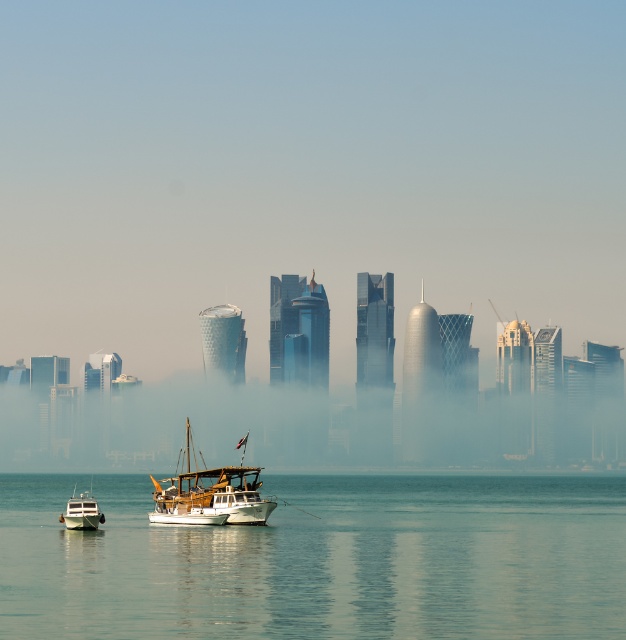
Question: Among these objects, which one is nearest to the camera?

Choices:
 (A) wooden sailboat at center
 (B) clear water at center
 (C) white wooden boat at lower left

Answer: (B)

Question: Observing the image, what is the correct spatial positioning of clear water at center in reference to white wooden boat at lower left?

Choices:
 (A) left
 (B) right

Answer: (B)

Question: Where is wooden sailboat at center located in relation to white wooden boat at lower left in the image?

Choices:
 (A) above
 (B) below

Answer: (A)

Question: Estimate the real-world distances between objects in this image. Which object is farther from the clear water at center?

Choices:
 (A) wooden sailboat at center
 (B) foggy glassy skyline at center

Answer: (B)

Question: Among these points, which one is nearest to the camera?

Choices:
 (A) (78, 497)
 (B) (590, 372)
 (C) (203, 518)
 (D) (382, 504)

Answer: (C)

Question: Considering the relative positions of wooden sailboat at center and white wooden boat at lower left in the image provided, where is wooden sailboat at center located with respect to white wooden boat at lower left?

Choices:
 (A) left
 (B) right

Answer: (B)